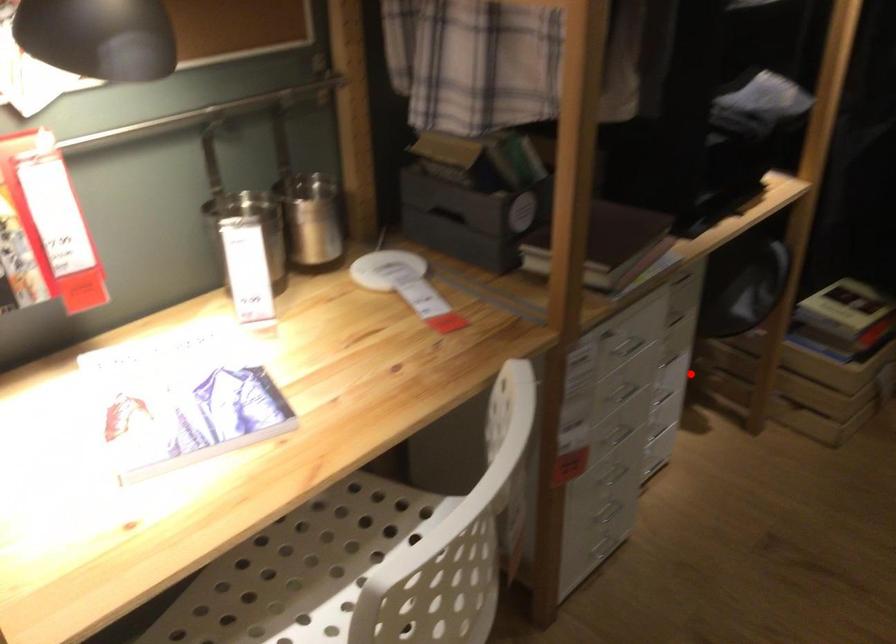
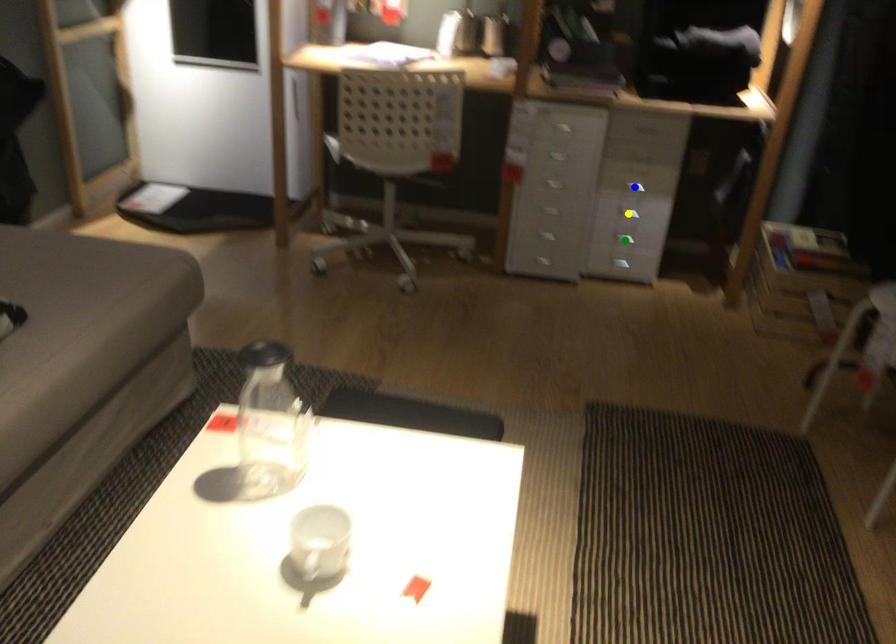
Question: I am providing you with two images of the same scene from different viewpoints. A red point is marked on the first image. You are given multiple points on the second image. In image 2, which mark is for the same physical point as the one in image 1?

Choices:
 (A) green point
 (B) yellow point
 (C) blue point

Answer: (C)